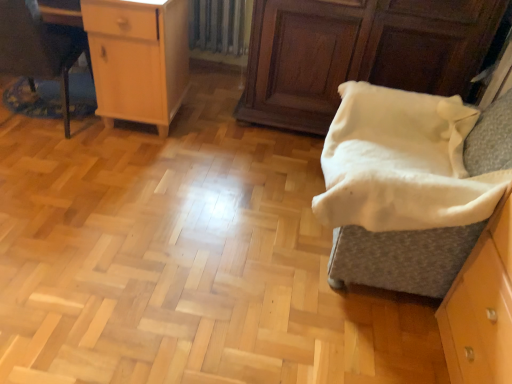
Question: Is light wood cabinet at upper left touching white soft blanket at right?

Choices:
 (A) yes
 (B) no

Answer: (B)

Question: From the image's perspective, is light wood cabinet at upper left beneath white soft blanket at right?

Choices:
 (A) no
 (B) yes

Answer: (A)

Question: Is light wood cabinet at upper left oriented towards white soft blanket at right?

Choices:
 (A) yes
 (B) no

Answer: (B)

Question: Is there a large distance between light wood cabinet at upper left and white soft blanket at right?

Choices:
 (A) yes
 (B) no

Answer: (A)

Question: Is light wood cabinet at upper left looking in the opposite direction of white soft blanket at right?

Choices:
 (A) no
 (B) yes

Answer: (A)

Question: From a real-world perspective, is metallic silver radiator at upper center positioned above or below light wood cabinet at upper left?

Choices:
 (A) below
 (B) above

Answer: (A)

Question: In terms of width, does metallic silver radiator at upper center look wider or thinner when compared to light wood cabinet at upper left?

Choices:
 (A) thin
 (B) wide

Answer: (A)

Question: Is point (234, 49) positioned closer to the camera than point (92, 23)?

Choices:
 (A) closer
 (B) farther

Answer: (B)

Question: Is metallic silver radiator at upper center taller or shorter than light wood cabinet at upper left?

Choices:
 (A) tall
 (B) short

Answer: (B)

Question: Is white soft blanket at right taller or shorter than metallic silver radiator at upper center?

Choices:
 (A) short
 (B) tall

Answer: (A)

Question: Considering their positions, is white soft blanket at right located in front of or behind metallic silver radiator at upper center?

Choices:
 (A) front
 (B) behind

Answer: (A)

Question: Is white soft blanket at right wider or thinner than metallic silver radiator at upper center?

Choices:
 (A) thin
 (B) wide

Answer: (B)

Question: Considering the relative positions of white soft blanket at right and metallic silver radiator at upper center in the image provided, is white soft blanket at right to the left or to the right of metallic silver radiator at upper center?

Choices:
 (A) left
 (B) right

Answer: (B)

Question: From the image's perspective, relative to brushed metal desk at left, is light wood cabinet at upper left above or below?

Choices:
 (A) above
 (B) below

Answer: (A)

Question: Considering the relative positions of light wood cabinet at upper left and brushed metal desk at left in the image provided, is light wood cabinet at upper left to the left or to the right of brushed metal desk at left?

Choices:
 (A) right
 (B) left

Answer: (A)